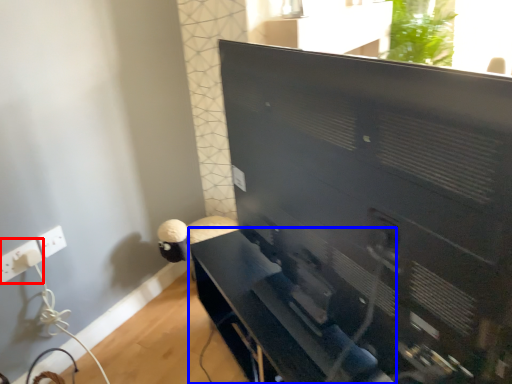
Question: Among these objects, which one is farthest to the camera, electric outlet (highlighted by a red box) or furniture (highlighted by a blue box)?

Choices:
 (A) electric outlet
 (B) furniture

Answer: (A)